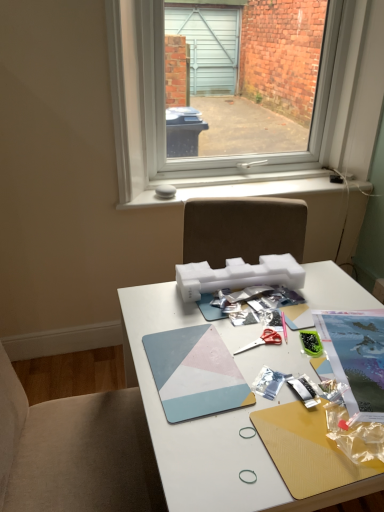
This screenshot has height=512, width=384. In order to click on vacant space behind geometric matte mousepad at center, acting as the 2th magazine starting from the right in this screenshot , I will do `click(174, 315)`.